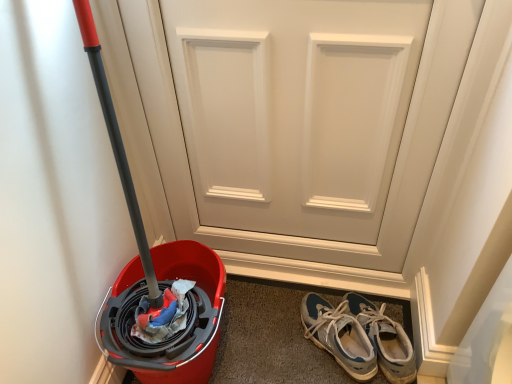
Question: From a real-world perspective, is blue suede sneakers at lower right, the 1th footwear in the right-to-left sequence, above or below blue suede sneakers at lower right, the 1th footwear positioned from the left?

Choices:
 (A) above
 (B) below

Answer: (B)

Question: Would you say blue suede sneakers at lower right, the 1th footwear in the right-to-left sequence, is inside or outside blue suede sneakers at lower right, the 1th footwear positioned from the left?

Choices:
 (A) outside
 (B) inside

Answer: (A)

Question: Considering the real-world distances, which object is closest to the blue suede sneakers at lower right, the 1th footwear in the right-to-left sequence?

Choices:
 (A) white matte door at center
 (B) blue suede sneakers at lower right, the 1th footwear positioned from the left

Answer: (B)

Question: Which object is positioned closest to the blue suede sneakers at lower right, the 1th footwear in the right-to-left sequence?

Choices:
 (A) white matte door at center
 (B) blue suede sneakers at lower right, the second footwear from the right

Answer: (B)